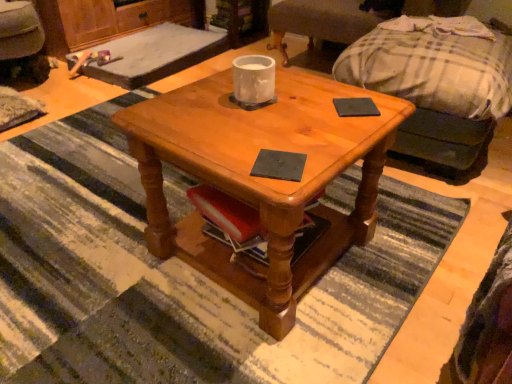
Question: Is black matte coaster at center, which is the first pad from left to right, aimed at matte wood coffee table at center?

Choices:
 (A) no
 (B) yes

Answer: (B)

Question: Is black matte coaster at center, the 1th pad from the bottom, touching matte wood coffee table at center?

Choices:
 (A) yes
 (B) no

Answer: (B)

Question: Is black matte coaster at center, the second pad positioned from the right, outside matte wood coffee table at center?

Choices:
 (A) no
 (B) yes

Answer: (A)

Question: Does black matte coaster at center, which is the first pad from left to right, have a lesser width compared to matte wood coffee table at center?

Choices:
 (A) yes
 (B) no

Answer: (A)

Question: Is matte wood coffee table at center at the back of black matte coaster at center, the second pad positioned from the right?

Choices:
 (A) no
 (B) yes

Answer: (B)

Question: Does black matte coaster at center, the second pad positioned from the right, have a greater width compared to matte wood coffee table at center?

Choices:
 (A) yes
 (B) no

Answer: (B)

Question: Could you tell me if velvet dark brown swivel chair at lower left, acting as the first swivel chair starting from the left, is turned towards matte wood coffee table at center?

Choices:
 (A) no
 (B) yes

Answer: (A)

Question: From a real-world perspective, is velvet dark brown swivel chair at lower left, placed as the second swivel chair when sorted from right to left, beneath matte wood coffee table at center?

Choices:
 (A) no
 (B) yes

Answer: (A)

Question: Can you confirm if velvet dark brown swivel chair at lower left, acting as the first swivel chair starting from the left, is positioned to the right of matte wood coffee table at center?

Choices:
 (A) yes
 (B) no

Answer: (B)

Question: Is velvet dark brown swivel chair at lower left, acting as the first swivel chair starting from the left, thinner than matte wood coffee table at center?

Choices:
 (A) no
 (B) yes

Answer: (A)

Question: Is velvet dark brown swivel chair at lower left, acting as the first swivel chair starting from the left, not inside matte wood coffee table at center?

Choices:
 (A) yes
 (B) no

Answer: (A)

Question: Is the position of velvet dark brown swivel chair at lower left, placed as the second swivel chair when sorted from right to left, more distant than that of matte wood coffee table at center?

Choices:
 (A) no
 (B) yes

Answer: (B)

Question: Would you say velvet dark brown swivel chair at lower left, acting as the first swivel chair starting from the left, is outside plaid fabric couch at upper right?

Choices:
 (A) yes
 (B) no

Answer: (A)